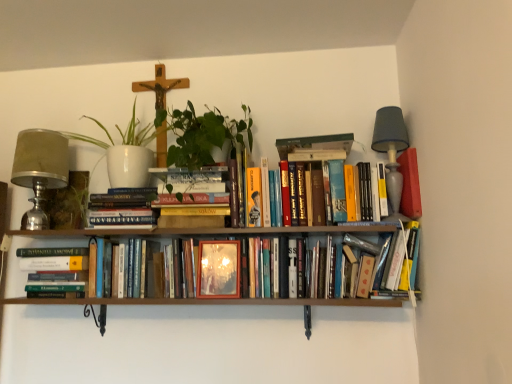
Question: Considering the positions of matte wooden frame at center and matte silver table lamp at left, the second table lamp viewed from the right, in the image, is matte wooden frame at center taller or shorter than matte silver table lamp at left, the second table lamp viewed from the right,?

Choices:
 (A) short
 (B) tall

Answer: (A)

Question: From a real-world perspective, is matte wooden frame at center above or below matte silver table lamp at left, the second table lamp viewed from the right?

Choices:
 (A) below
 (B) above

Answer: (A)

Question: Which object is the closest to the matte silver table lamp at left, the second table lamp viewed from the right?

Choices:
 (A) matte wooden frame at center
 (B) gray fabric lampshade at upper right, which ranks as the 2th table lamp in left-to-right order
 (C) white ceramic pot at upper left
 (D) hardcover book at lower left, the third book in the right-to-left sequence
 (E) hardcover books at center, which appears as the 2th book when viewed from the left

Answer: (C)

Question: Which object is positioned closest to the hardcover book at lower left, the 1th book in the left-to-right sequence?

Choices:
 (A) green matte vase at left
 (B) white ceramic pot at upper left
 (C) matte silver table lamp at left, the second table lamp viewed from the right
 (D) hardcover books at center, the 2th book from the right
 (E) matte wooden frame at center

Answer: (A)